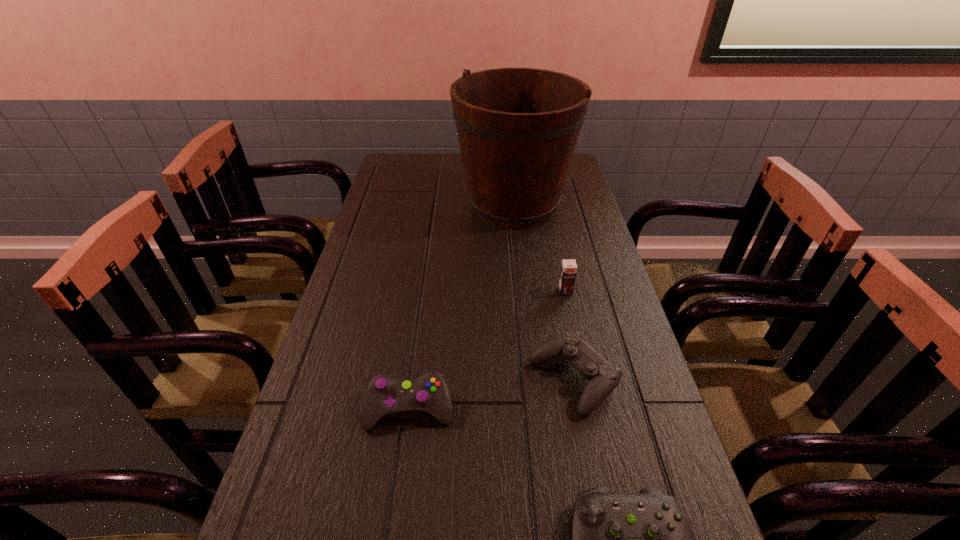
Find the location of `bucket present at the right edge`. bucket present at the right edge is located at coordinates (518, 128).

What are the coordinates of `chocolate milk at the right edge` in the screenshot? It's located at (568, 272).

Where is `control positioned at the right edge`? control positioned at the right edge is located at coordinates (x=603, y=378).

Where is `object that is at the far right corner`? object that is at the far right corner is located at coordinates [x=518, y=128].

I want to click on vacant space at the far edge of the desktop, so click(x=430, y=179).

Locate an element on the screen. free location at the left edge is located at coordinates (384, 270).

The width and height of the screenshot is (960, 540). I want to click on vacant space at the right edge, so click(x=625, y=375).

In the image, there is a desktop. At what (x,y) coordinates should I click in order to perform the action: click on vacant area at the far left corner. Please return your answer as a coordinate pair (x, y). Looking at the image, I should click on coord(420,161).

Where is `vacant space that's between the bucket and the fourth shortest object`? Image resolution: width=960 pixels, height=540 pixels. vacant space that's between the bucket and the fourth shortest object is located at coordinates 540,248.

Locate an element on the screen. Image resolution: width=960 pixels, height=540 pixels. free space between the farthest object and the leftmost control is located at coordinates (462, 307).